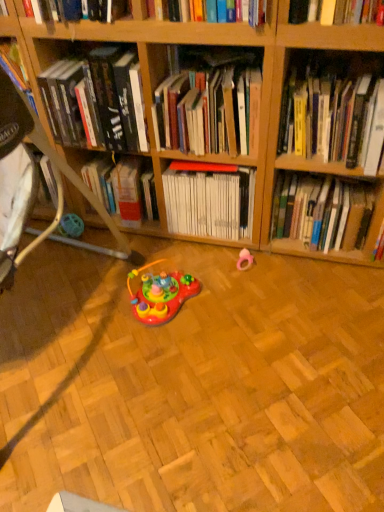
Image resolution: width=384 pixels, height=512 pixels. What do you see at coordinates (209, 200) in the screenshot?
I see `white matte book at center, which is the 3th book in right-to-left order` at bounding box center [209, 200].

This screenshot has height=512, width=384. Find the location of `hardcover book at center, which is the 1th book in right-to-left order`. hardcover book at center, which is the 1th book in right-to-left order is located at coordinates [x=323, y=211].

Locate an element on the screen. The width and height of the screenshot is (384, 512). hardcover book at upper center, the 1th book in the left-to-right sequence is located at coordinates (96, 100).

What is the approximate width of shiny plastic toy at center, placed as the 2th toy when sorted from right to left?

shiny plastic toy at center, placed as the 2th toy when sorted from right to left, is 12.24 inches in width.

Identify the location of white matte book at center, which is the 3th book in right-to-left order. point(209,200).

Is white matte book at center, which appears as the third book when viewed from the left, outside of hardcover book at center, which is the 1th book in right-to-left order?

Yes, white matte book at center, which appears as the third book when viewed from the left, is outside of hardcover book at center, which is the 1th book in right-to-left order.

Locate an element on the screen. The height and width of the screenshot is (512, 384). book that is under the hardcover book at center, which is the 1th book in right-to-left order (from a real-world perspective) is located at coordinates (209, 200).

How many degrees apart are the facing directions of white matte book at center, which is the 3th book in right-to-left order, and hardcover book at center, which is the 1th book in right-to-left order?

0.000597 degrees.

Considering the positions of objects shiny plastic toy at center, which is the first toy in left-to-right order, and hardcover book at center, marked as the fifth book in a left-to-right arrangement, in the image provided, who is behind, shiny plastic toy at center, which is the first toy in left-to-right order, or hardcover book at center, marked as the fifth book in a left-to-right arrangement,?

shiny plastic toy at center, which is the first toy in left-to-right order.

At what (x,y) coordinates should I click in order to perform the action: click on toy that is the 1st one when counting backward from the hardcover book at center, marked as the fifth book in a left-to-right arrangement. Please return your answer as a coordinate pair (x, y). Looking at the image, I should click on (160, 294).

From a real-world perspective, is shiny plastic toy at center, placed as the 2th toy when sorted from right to left, beneath hardcover book at center, which is the 1th book in right-to-left order?

Correct, in the physical world, shiny plastic toy at center, placed as the 2th toy when sorted from right to left, is lower than hardcover book at center, which is the 1th book in right-to-left order.

Does yellow hardcover book at upper right, acting as the fourth book starting from the left, have a greater height compared to hardcover book at upper center, the 1th book in the left-to-right sequence?

Incorrect, the height of yellow hardcover book at upper right, acting as the fourth book starting from the left, is not larger of that of hardcover book at upper center, the 1th book in the left-to-right sequence.

Which object is further away from the camera, yellow hardcover book at upper right, the 2th book positioned from the right, or hardcover book at upper center, the 5th book when ordered from right to left?

Positioned behind is hardcover book at upper center, the 5th book when ordered from right to left.

Image resolution: width=384 pixels, height=512 pixels. There is a yellow hardcover book at upper right, acting as the fourth book starting from the left. What are the coordinates of `the 2nd book above it (from the image's perspective)` in the screenshot? It's located at (96, 100).

From a real-world perspective, which is physically above, yellow hardcover book at upper right, acting as the fourth book starting from the left, or hardcover book at upper center, the 5th book when ordered from right to left?

hardcover book at upper center, the 5th book when ordered from right to left, is physically above.

Considering the sizes of hardcover book at upper center, the 5th book when ordered from right to left, and yellow hardcover book at upper right, the 2th book positioned from the right, in the image, is hardcover book at upper center, the 5th book when ordered from right to left, bigger or smaller than yellow hardcover book at upper right, the 2th book positioned from the right,?

Considering their sizes, hardcover book at upper center, the 5th book when ordered from right to left, takes up more space than yellow hardcover book at upper right, the 2th book positioned from the right.

Consider the image. Which is in front, hardcover book at upper center, the 1th book in the left-to-right sequence, or yellow hardcover book at upper right, the 2th book positioned from the right?

yellow hardcover book at upper right, the 2th book positioned from the right, is more forward.

From a real-world perspective, starting from the hardcover book at upper center, the 1th book in the left-to-right sequence, which book is the 2nd one below it? Please provide its 2D coordinates.

[(333, 118)]

Considering the relative sizes of hardcover book at upper center, the 5th book when ordered from right to left, and yellow hardcover book at upper right, the 2th book positioned from the right, in the image provided, is hardcover book at upper center, the 5th book when ordered from right to left, wider than yellow hardcover book at upper right, the 2th book positioned from the right,?

Correct, the width of hardcover book at upper center, the 5th book when ordered from right to left, exceeds that of yellow hardcover book at upper right, the 2th book positioned from the right.

Considering the relative positions of hardcover book at upper center, the 5th book when ordered from right to left, and hardcover books at center, positioned as the second book in left-to-right order, in the image provided, is hardcover book at upper center, the 5th book when ordered from right to left, to the left or to the right of hardcover books at center, positioned as the second book in left-to-right order,?

Clearly, hardcover book at upper center, the 5th book when ordered from right to left, is on the left of hardcover books at center, positioned as the second book in left-to-right order, in the image.

Does hardcover book at upper center, the 1th book in the left-to-right sequence, come behind hardcover books at center, the 4th book from the right?

Yes, hardcover book at upper center, the 1th book in the left-to-right sequence, is further from the viewer.

Does point (57, 63) appear closer or farther from the camera than point (228, 117)?

Point (57, 63) is farther from the camera than point (228, 117).

Who is smaller, hardcover book at upper center, the 1th book in the left-to-right sequence, or hardcover books at center, positioned as the second book in left-to-right order?

Smaller between the two is hardcover books at center, positioned as the second book in left-to-right order.

Is hardcover books at center, the 4th book from the right, not near hardcover book at center, which is the 1th book in right-to-left order?

No, there isn't a large distance between hardcover books at center, the 4th book from the right, and hardcover book at center, which is the 1th book in right-to-left order.

Which of these two, hardcover books at center, positioned as the second book in left-to-right order, or hardcover book at center, which is the 1th book in right-to-left order, is bigger?

hardcover book at center, which is the 1th book in right-to-left order.

What's the angular difference between hardcover books at center, positioned as the second book in left-to-right order, and hardcover book at center, marked as the fifth book in a left-to-right arrangement,'s facing directions?

The facing directions of hardcover books at center, positioned as the second book in left-to-right order, and hardcover book at center, marked as the fifth book in a left-to-right arrangement, are 0.00111 degrees apart.

Image resolution: width=384 pixels, height=512 pixels. Identify the location of the 2nd book in front of the hardcover book at center, which is the 1th book in right-to-left order, starting your count from the anchor. (210, 103).

Is the surface of hardcover book at center, marked as the fifth book in a left-to-right arrangement, in direct contact with yellow hardcover book at upper right, the 2th book positioned from the right?

hardcover book at center, marked as the fifth book in a left-to-right arrangement, is not next to yellow hardcover book at upper right, the 2th book positioned from the right, and they're not touching.

From a real-world perspective, is hardcover book at center, which is the 1th book in right-to-left order, positioned under yellow hardcover book at upper right, the 2th book positioned from the right, based on gravity?

Correct, in the physical world, hardcover book at center, which is the 1th book in right-to-left order, is lower than yellow hardcover book at upper right, the 2th book positioned from the right.

Which object is positioned more to the right, hardcover book at center, marked as the fifth book in a left-to-right arrangement, or yellow hardcover book at upper right, the 2th book positioned from the right?

From the viewer's perspective, hardcover book at center, marked as the fifth book in a left-to-right arrangement, appears more on the right side.

The height and width of the screenshot is (512, 384). In order to click on the 2nd book below when counting from the yellow hardcover book at upper right, acting as the fourth book starting from the left (from the image's perspective) in this screenshot , I will do `click(323, 211)`.

I want to click on book that is the 2nd one when counting rightward from the white matte book at center, which is the 3th book in right-to-left order, so click(x=323, y=211).

This screenshot has width=384, height=512. Find the location of `the 1st book above when counting from the shiny plastic toy at center, placed as the 2th toy when sorted from right to left (from the image's perspective)`. the 1st book above when counting from the shiny plastic toy at center, placed as the 2th toy when sorted from right to left (from the image's perspective) is located at coordinates (323, 211).

Estimate the real-world distances between objects in this image. Which object is further from yellow hardcover book at upper right, the 2th book positioned from the right, shiny plastic toy at center, which is the first toy in left-to-right order, or hardcover book at center, which is the 1th book in right-to-left order?

Based on the image, shiny plastic toy at center, which is the first toy in left-to-right order, appears to be further to yellow hardcover book at upper right, the 2th book positioned from the right.

Based on their spatial positions, is hardcover books at center, positioned as the second book in left-to-right order, or yellow hardcover book at upper right, acting as the fourth book starting from the left, further from hardcover book at upper center, the 1th book in the left-to-right sequence?

yellow hardcover book at upper right, acting as the fourth book starting from the left, is further to hardcover book at upper center, the 1th book in the left-to-right sequence.

Estimate the real-world distances between objects in this image. Which object is further from white matte book at center, which appears as the third book when viewed from the left, pink rubber ring at center, which is the first toy in right-to-left order, or hardcover book at center, marked as the fifth book in a left-to-right arrangement?

hardcover book at center, marked as the fifth book in a left-to-right arrangement, is positioned further to the anchor white matte book at center, which appears as the third book when viewed from the left.

When comparing their distances from yellow hardcover book at upper right, acting as the fourth book starting from the left, does shiny plastic toy at center, which is the first toy in left-to-right order, or hardcover book at upper center, the 5th book when ordered from right to left, seem further?

Among the two, shiny plastic toy at center, which is the first toy in left-to-right order, is located further to yellow hardcover book at upper right, acting as the fourth book starting from the left.

When comparing their distances from white matte book at center, which is the 3th book in right-to-left order, does hardcover book at upper center, the 1th book in the left-to-right sequence, or shiny plastic toy at center, placed as the 2th toy when sorted from right to left, seem further?

The object further to white matte book at center, which is the 3th book in right-to-left order, is hardcover book at upper center, the 1th book in the left-to-right sequence.

Considering their positions, is pink rubber ring at center, which is the first toy in right-to-left order, positioned closer to white matte book at center, which is the 3th book in right-to-left order, than shiny plastic toy at center, placed as the 2th toy when sorted from right to left?

Among the two, pink rubber ring at center, which is the first toy in right-to-left order, is located nearer to white matte book at center, which is the 3th book in right-to-left order.

Which object lies further to the anchor point hardcover book at center, marked as the fifth book in a left-to-right arrangement, hardcover books at center, positioned as the second book in left-to-right order, or hardcover book at upper center, the 5th book when ordered from right to left?

hardcover book at upper center, the 5th book when ordered from right to left, lies further to hardcover book at center, marked as the fifth book in a left-to-right arrangement, than the other object.

When comparing their distances from pink rubber ring at center, which is the first toy in right-to-left order, does white matte book at center, which appears as the third book when viewed from the left, or shiny plastic toy at center, which is the first toy in left-to-right order, seem closer?

white matte book at center, which appears as the third book when viewed from the left.

Where is `book between white matte book at center, which is the 3th book in right-to-left order, and hardcover book at center, marked as the fifth book in a left-to-right arrangement, from left to right`? Image resolution: width=384 pixels, height=512 pixels. book between white matte book at center, which is the 3th book in right-to-left order, and hardcover book at center, marked as the fifth book in a left-to-right arrangement, from left to right is located at coordinates (333, 118).

Where is `toy between hardcover book at upper center, the 1th book in the left-to-right sequence, and shiny plastic toy at center, which is the first toy in left-to-right order, vertically`? toy between hardcover book at upper center, the 1th book in the left-to-right sequence, and shiny plastic toy at center, which is the first toy in left-to-right order, vertically is located at coordinates (245, 260).

Image resolution: width=384 pixels, height=512 pixels. I want to click on toy that lies between white matte book at center, which is the 3th book in right-to-left order, and shiny plastic toy at center, which is the first toy in left-to-right order, from top to bottom, so click(x=245, y=260).

Identify the location of toy between white matte book at center, which appears as the third book when viewed from the left, and hardcover book at center, which is the 1th book in right-to-left order, in the horizontal direction. Image resolution: width=384 pixels, height=512 pixels. (245, 260).